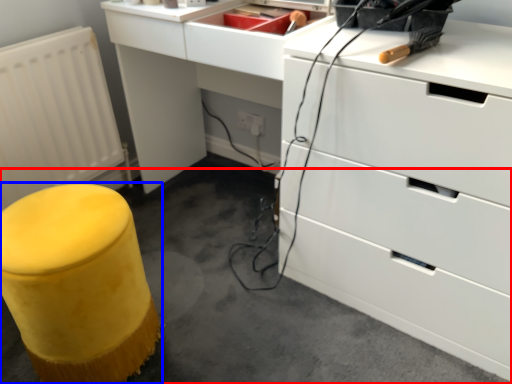
Question: Which point is closer to the camera, concrete (highlighted by a red box) or furniture (highlighted by a blue box)?

Choices:
 (A) concrete
 (B) furniture

Answer: (A)